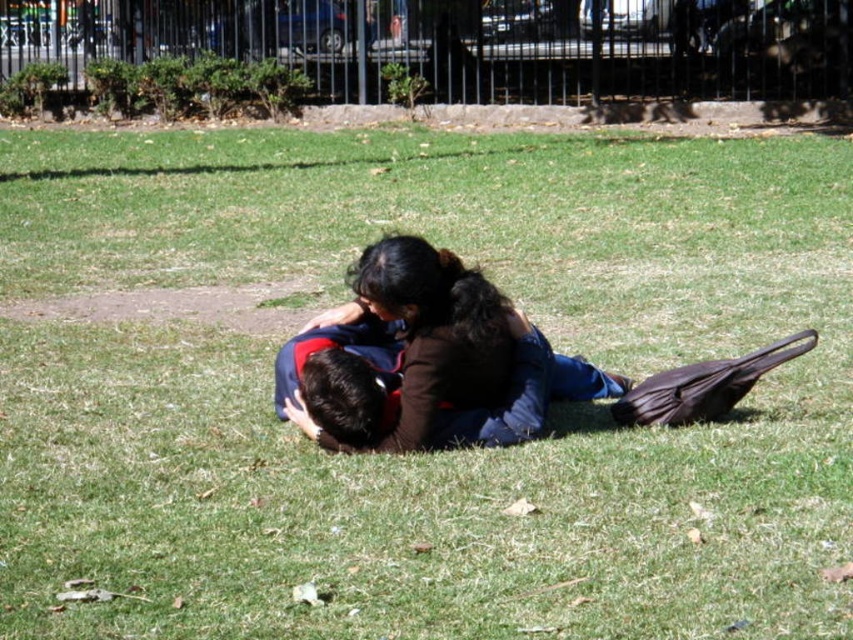
Question: Does matte blue shirt at center have a greater width compared to dark blue fabric shirt at center?

Choices:
 (A) no
 (B) yes

Answer: (B)

Question: Which of the following is the closest to the observer?

Choices:
 (A) (340, 436)
 (B) (392, 257)

Answer: (B)

Question: Does matte blue shirt at center have a larger size compared to dark blue fabric shirt at center?

Choices:
 (A) yes
 (B) no

Answer: (A)

Question: Is matte blue shirt at center smaller than dark blue fabric shirt at center?

Choices:
 (A) no
 (B) yes

Answer: (A)

Question: Which of the following is the closest to the observer?

Choices:
 (A) dark blue fabric shirt at center
 (B) matte blue shirt at center

Answer: (B)